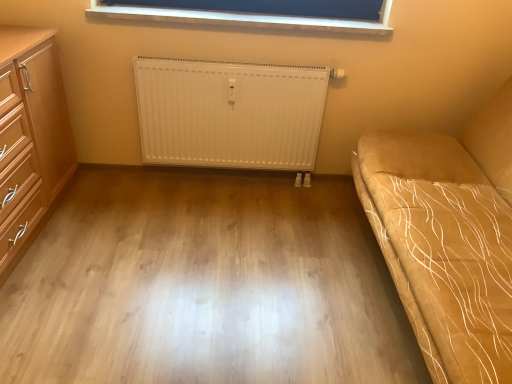
Image resolution: width=512 pixels, height=384 pixels. Identify the location of free spot in front of white ribbed radiator at center. (195, 251).